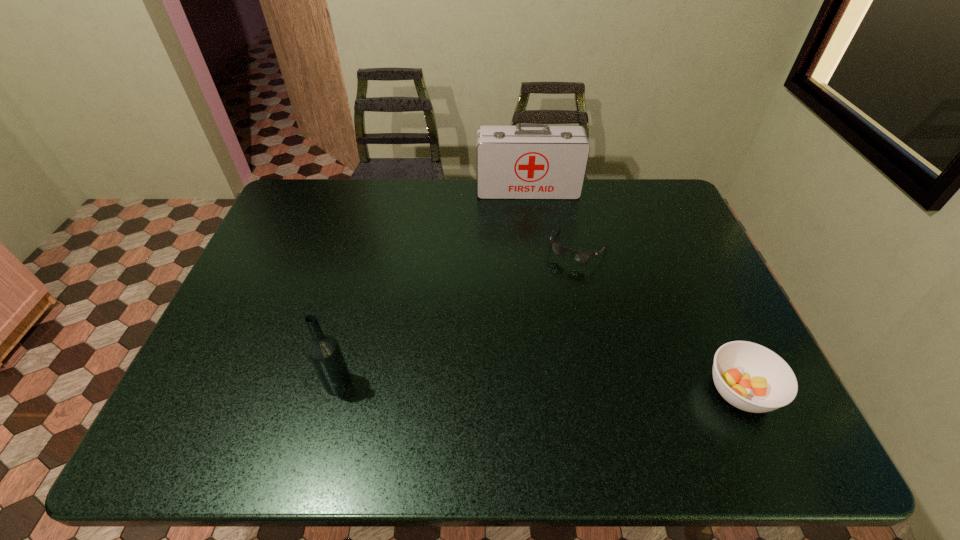
Where is `vacant space on the desktop that is between the leftmost object and the second shortest object and is positioned on the front-facing side of the shortest object`? This screenshot has width=960, height=540. vacant space on the desktop that is between the leftmost object and the second shortest object and is positioned on the front-facing side of the shortest object is located at coordinates pos(496,386).

Locate an element on the screen. free space on the desktop that is between the vodka and the soup bowl and is positioned on the front-facing side of the farthest object is located at coordinates (550, 387).